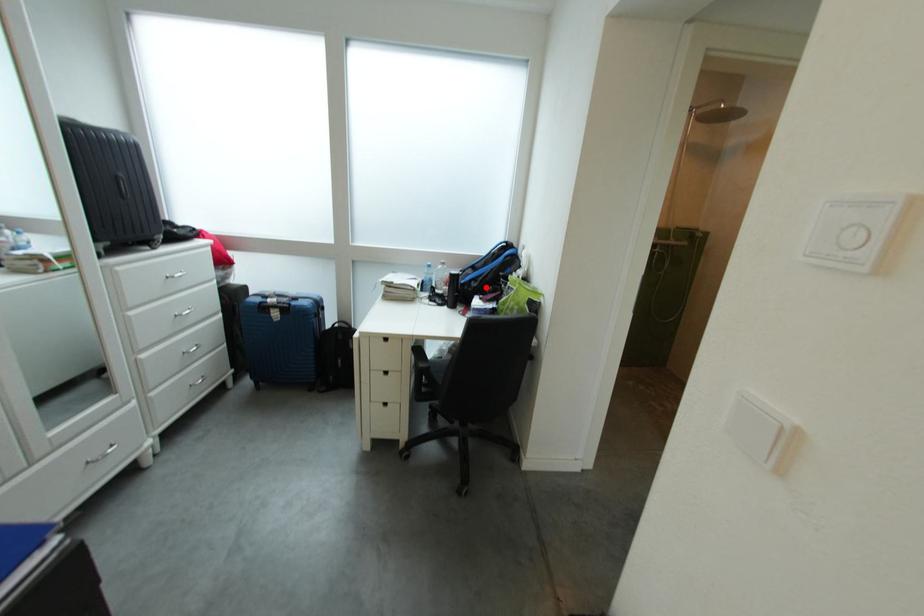
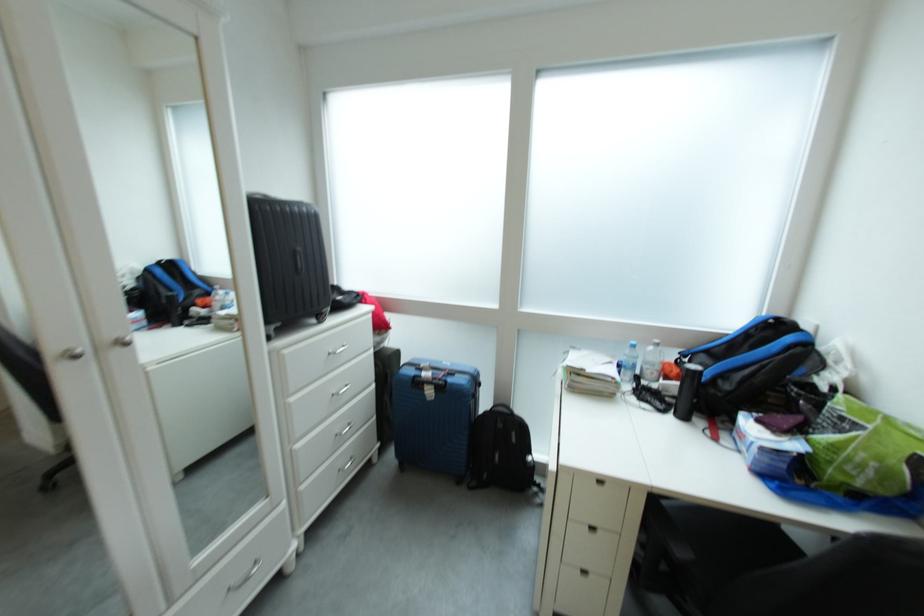
The point at the highlighted location is marked in the first image. Where is the corresponding point in the second image?

(737, 390)